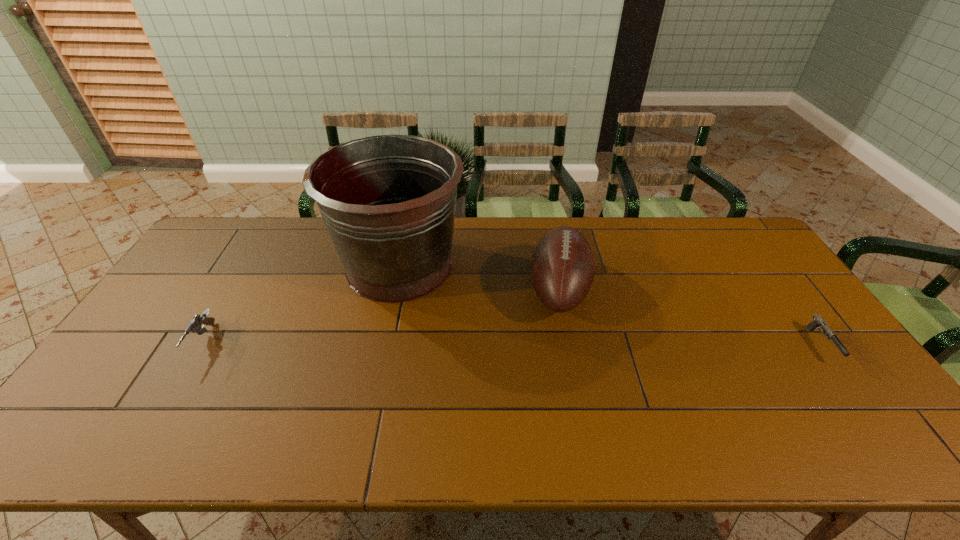
I want to click on the tallest object, so click(388, 201).

Image resolution: width=960 pixels, height=540 pixels. I want to click on the third object from right to left, so click(388, 201).

Identify the location of the third shortest object. Image resolution: width=960 pixels, height=540 pixels. (562, 268).

In order to click on the third object from left to right in this screenshot , I will do `click(562, 268)`.

Identify the location of the left gun. This screenshot has width=960, height=540. (195, 325).

Locate an element on the screen. The height and width of the screenshot is (540, 960). the taller gun is located at coordinates (195, 325).

Image resolution: width=960 pixels, height=540 pixels. In order to click on the right gun in this screenshot , I will do `click(818, 321)`.

This screenshot has width=960, height=540. Identify the location of the shorter gun. (818, 321).

Locate an element on the screen. The width and height of the screenshot is (960, 540). vacant space located 0.320m on the left of the bucket is located at coordinates (234, 266).

Where is `vacant space positioned 0.330m on the right of the third shortest object`? The height and width of the screenshot is (540, 960). vacant space positioned 0.330m on the right of the third shortest object is located at coordinates (697, 290).